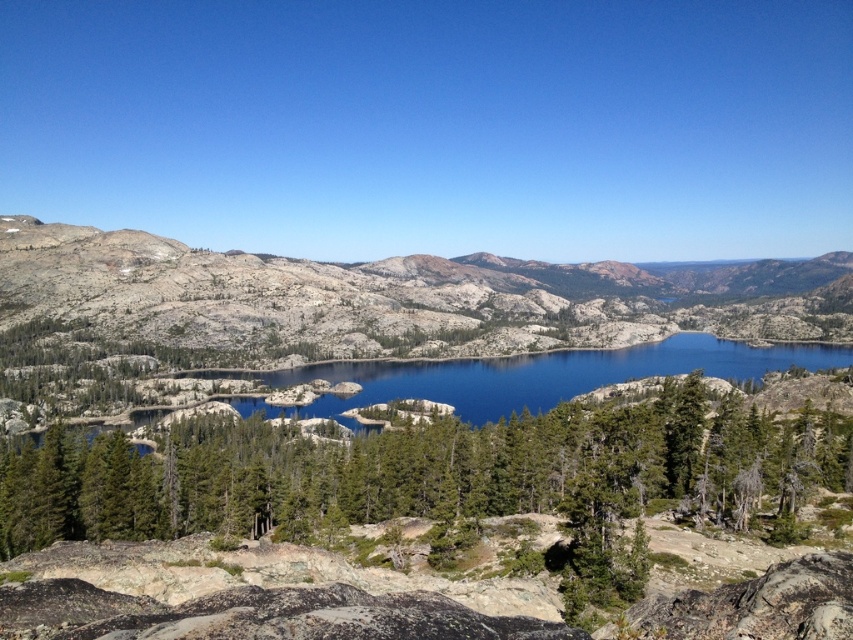
You are a hiker planning to take a photo of the gray granite mountain at center and the blue reflective water at center. Which object should you focus on first if you want to capture both in a single frame without moving your camera?

You should focus on the gray granite mountain at center first because it is larger than the blue reflective water at center, making it the dominant subject in the scene.

You are a hiker standing at the edge of the gray granite mountain at center and looking towards the blue reflective water at center. Which direction should you go to reach the water?

The gray granite mountain at center is positioned on the right side of blue reflective water at center, so to reach the water, you should go to the left.